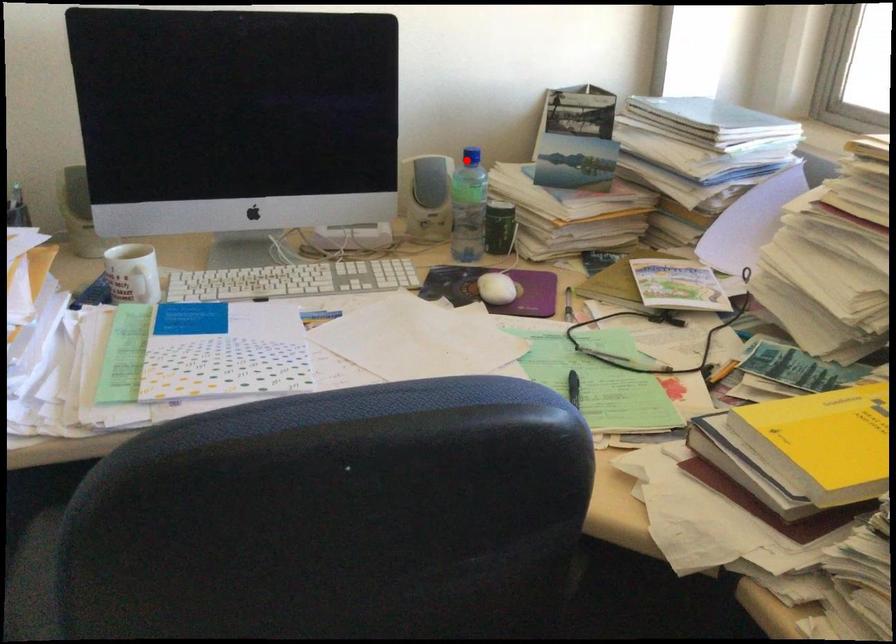
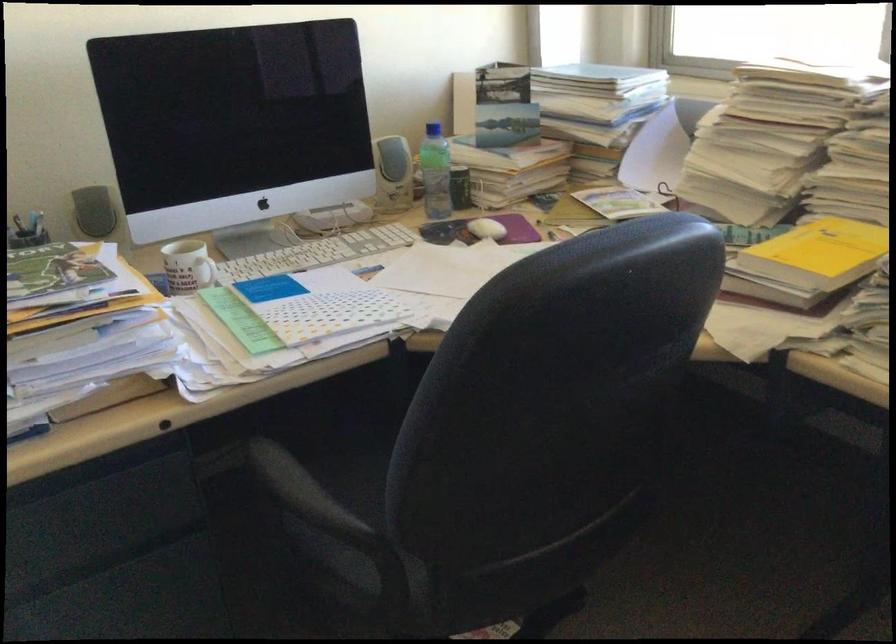
Find the pixel in the second image that matches the highlighted location in the first image.

(433, 129)